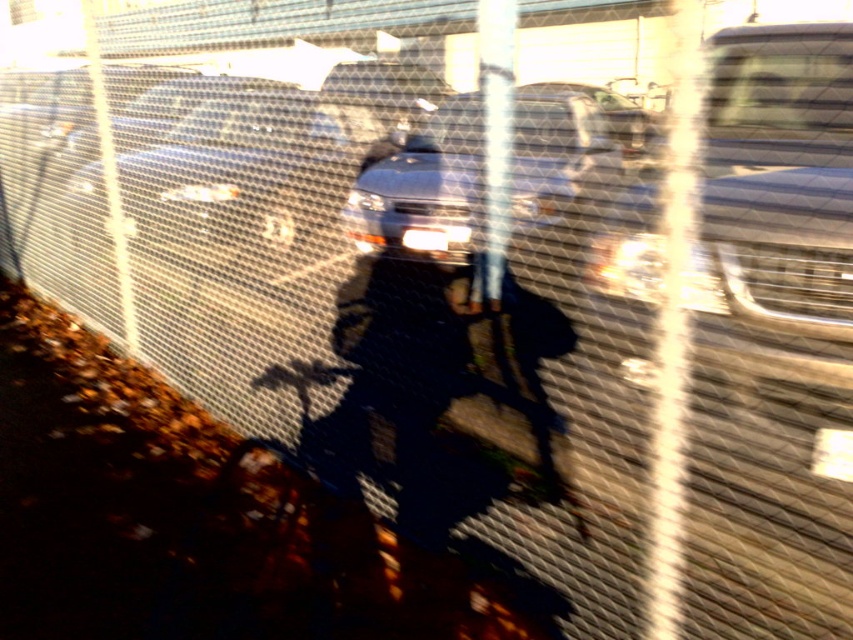
Is metallic silver bicycle at center closer to the viewer compared to satin silver sedan at center?

Yes.

Between metallic silver bicycle at center and satin silver sedan at center, which one has more height?

satin silver sedan at center is taller.

Locate an element on the screen. The height and width of the screenshot is (640, 853). metallic silver bicycle at center is located at coordinates (428, 458).

In the scene shown: Does metallic silver bicycle at center come behind metallic silver car at center?

No, it is not.

Who is lower down, metallic silver bicycle at center or metallic silver car at center?

metallic silver bicycle at center is below.

Locate an element on the screen. The width and height of the screenshot is (853, 640). metallic silver bicycle at center is located at coordinates (428, 458).

Consider the image. Is metallic silver car at center to the right of satin silver sedan at center from the viewer's perspective?

No, metallic silver car at center is not to the right of satin silver sedan at center.

The width and height of the screenshot is (853, 640). What do you see at coordinates (247, 179) in the screenshot?
I see `metallic silver car at center` at bounding box center [247, 179].

Identify the location of metallic silver car at center. (247, 179).